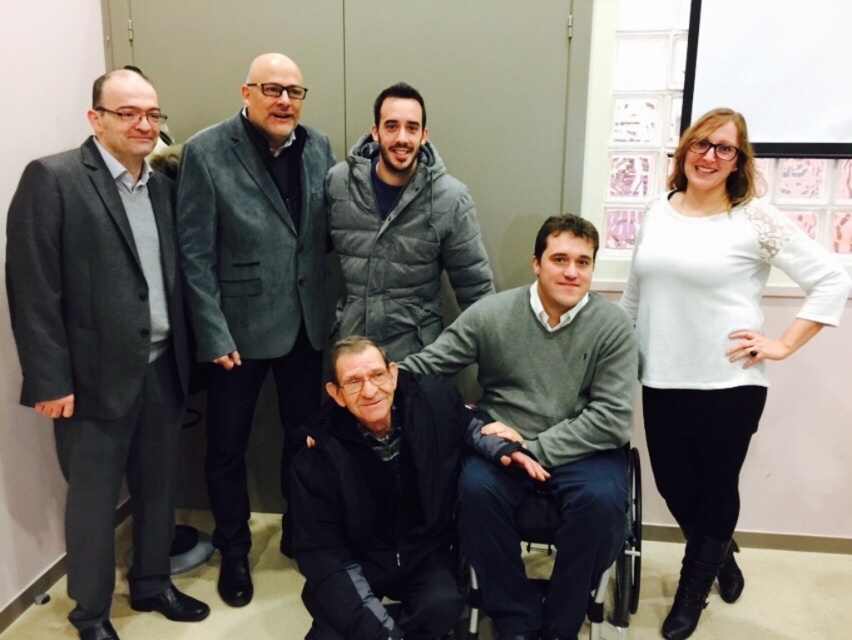
You are standing in the room where the group is posing. You want to take a photo of the point at coordinate (304, 236) without moving the camera. Is the point within the camera frame?

The point at coordinate (304, 236) is 8.12 feet away from the camera. Since the point is within the camera frame, you can take the photo without moving the camera.